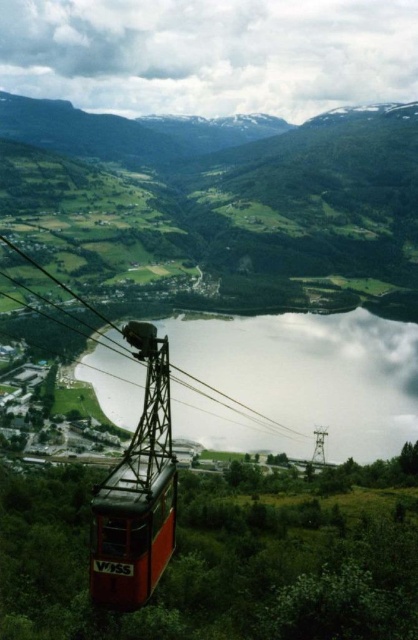
Question: Can you confirm if smooth reflective water at center is positioned to the right of metallic cable car at center?

Choices:
 (A) no
 (B) yes

Answer: (B)

Question: Among these points, which one is nearest to the camera?

Choices:
 (A) (348, 413)
 (B) (216, 104)

Answer: (A)

Question: Which object is the closest to the white fluffy cloud at upper center?

Choices:
 (A) smooth reflective water at center
 (B) metallic cable car at center

Answer: (A)

Question: Can you confirm if white fluffy cloud at upper center is positioned to the left of metallic cable car at center?

Choices:
 (A) yes
 (B) no

Answer: (A)

Question: Is white fluffy cloud at upper center to the right of smooth reflective water at center from the viewer's perspective?

Choices:
 (A) yes
 (B) no

Answer: (B)

Question: Which is farther from the white fluffy cloud at upper center?

Choices:
 (A) metallic cable car at center
 (B) smooth reflective water at center

Answer: (A)